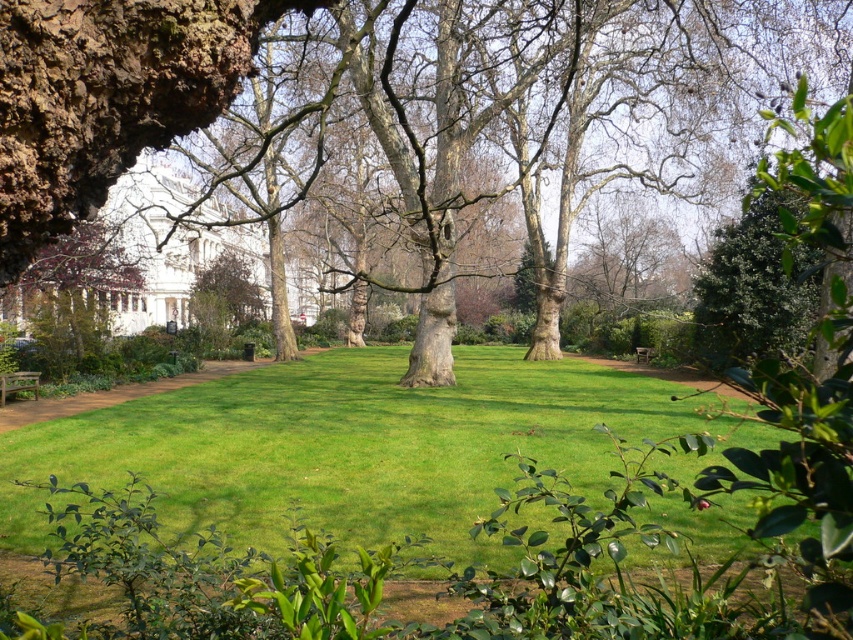
Question: Can you confirm if brown rough bark tree at center is wider than wooden park bench at lower left?

Choices:
 (A) yes
 (B) no

Answer: (A)

Question: Estimate the real-world distances between objects in this image. Which object is farther from the green grass at center?

Choices:
 (A) wooden park bench at lower left
 (B) smooth bark tree at left
 (C) brown rough bark tree at center
 (D) brown textured tree at center

Answer: (D)

Question: Does brown rough bark tree at center appear on the right side of wooden park bench at center?

Choices:
 (A) no
 (B) yes

Answer: (A)

Question: Which point is closer to the camera?

Choices:
 (A) (598, 396)
 (B) (20, 371)

Answer: (A)

Question: Which point is closer to the camera?

Choices:
 (A) (67, 164)
 (B) (654, 349)

Answer: (A)

Question: Can you confirm if brown textured tree at center is positioned above wooden park bench at center?

Choices:
 (A) no
 (B) yes

Answer: (B)